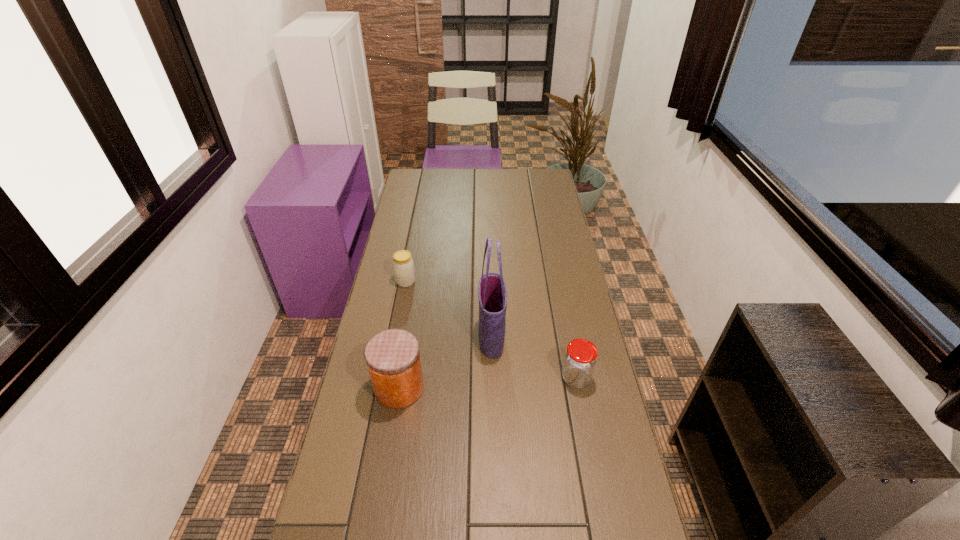
Where is `the tallest object`? The width and height of the screenshot is (960, 540). the tallest object is located at coordinates (492, 294).

Find the location of `tote bag`. tote bag is located at coordinates (492, 294).

In order to click on the second tallest object in this screenshot , I will do [392, 356].

Find the location of a particular element. the rightmost jar is located at coordinates (580, 358).

I want to click on the farthest object, so [x=403, y=265].

Where is `vacant point located 0.240m on the front of the second object from right to left`? vacant point located 0.240m on the front of the second object from right to left is located at coordinates (493, 430).

Where is `vacant point located 0.320m on the front of the third shortest object`? The width and height of the screenshot is (960, 540). vacant point located 0.320m on the front of the third shortest object is located at coordinates (375, 535).

Identify the location of free location located on the front of the rightmost jar. This screenshot has height=540, width=960. (x=604, y=521).

The image size is (960, 540). Find the location of `vacant space located 0.170m on the front of the farthest jar`. vacant space located 0.170m on the front of the farthest jar is located at coordinates (398, 322).

The width and height of the screenshot is (960, 540). Identify the location of object that is at the right edge. (580, 358).